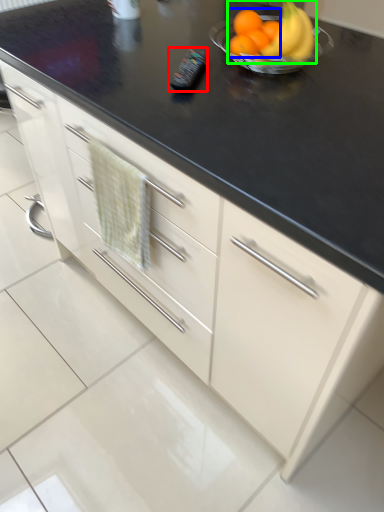
Question: Which is farther away from appliance (highlighted by a red box)? citrus fruit (highlighted by a blue box) or grapefruit (highlighted by a green box)?

Choices:
 (A) citrus fruit
 (B) grapefruit

Answer: (B)